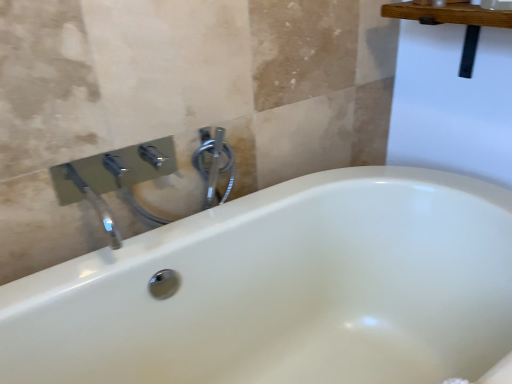
Question: In terms of height, does polished chrome faucet at upper left look taller or shorter compared to polished chrome faucet at upper center?

Choices:
 (A) short
 (B) tall

Answer: (B)

Question: Would you say polished chrome faucet at upper left is to the left or to the right of polished chrome faucet at upper center in the picture?

Choices:
 (A) left
 (B) right

Answer: (A)

Question: From the image's perspective, is polished chrome faucet at upper left located above or below polished chrome faucet at upper center?

Choices:
 (A) below
 (B) above

Answer: (A)

Question: From a real-world perspective, is polished chrome faucet at upper center positioned above or below polished chrome faucet at upper left?

Choices:
 (A) above
 (B) below

Answer: (A)

Question: Looking at their shapes, would you say polished chrome faucet at upper center is wider or thinner than polished chrome faucet at upper left?

Choices:
 (A) wide
 (B) thin

Answer: (B)

Question: Based on their sizes in the image, would you say polished chrome faucet at upper center is bigger or smaller than polished chrome faucet at upper left?

Choices:
 (A) small
 (B) big

Answer: (A)

Question: In terms of height, does polished chrome faucet at upper center look taller or shorter compared to polished chrome faucet at upper left?

Choices:
 (A) tall
 (B) short

Answer: (B)